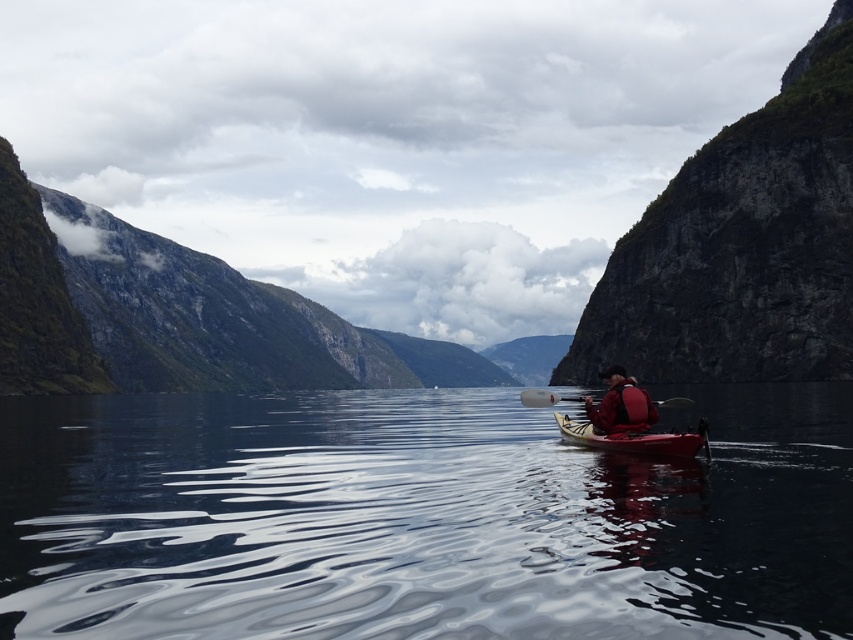
Is rugged stone cliff at right positioned at the back of red nylon jacket at center?

Yes, it is.

Is point (843, 61) positioned after point (592, 404)?

Yes.

Measure the distance between point (712, 241) and camera.

Point (712, 241) is 218.00 meters from camera.

At what (x,y) coordinates should I click in order to perform the action: click on rugged stone cliff at right. Please return your answer as a coordinate pair (x, y). This screenshot has height=640, width=853. Looking at the image, I should click on (741, 244).

Does point (646, 372) come in front of point (558, 397)?

No, (646, 372) is further to viewer.

Does rugged stone cliff at right have a greater width compared to white plastic paddle at center?

Yes.

Is point (756, 355) positioned after point (520, 394)?

Yes.

The image size is (853, 640). I want to click on rugged stone cliff at right, so click(x=741, y=244).

Does matte red canoe at center have a lesser height compared to red nylon jacket at center?

Yes.

Between matte red canoe at center and red nylon jacket at center, which one appears on the left side from the viewer's perspective?

From the viewer's perspective, matte red canoe at center appears more on the left side.

This screenshot has width=853, height=640. What do you see at coordinates (637, 438) in the screenshot?
I see `matte red canoe at center` at bounding box center [637, 438].

Where is `matte red canoe at center`? matte red canoe at center is located at coordinates (637, 438).